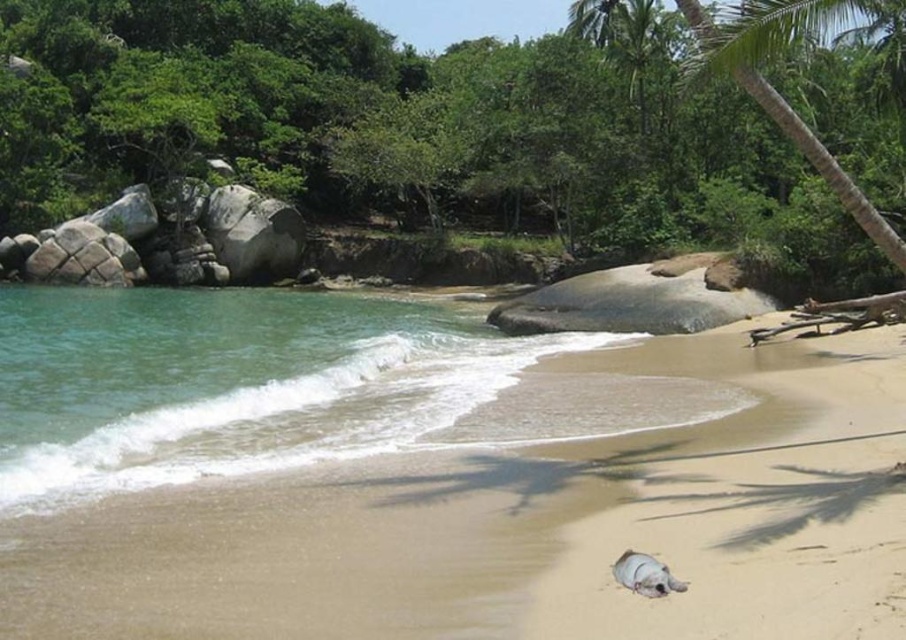
You are standing on the beach and want to walk from the clear water at lower left to the green leafy palm tree at upper right. Which direction should you move first?

You should move towards the upper right direction first because the clear water at lower left is located at the lower left and the green leafy palm tree at upper right is at the upper right, so moving in that direction will take you closer to the palm tree.

You are standing on the beach and want to walk from the light brown sand at lower center to the green leafy palm tree at upper right. Which direction should you move to get closer to the palm tree?

You should move upward because the green leafy palm tree at upper right is further away from you than the light brown sand at lower center, so moving upward towards it will bring you closer.

You are standing on the beach and want to take a photo of the clear water at lower left and the green leafy palm tree at upper right. Which object will appear closer to the camera in your photo?

The clear water at lower left will appear closer to the camera in the photo because the green leafy palm tree at upper right is positioned behind it.